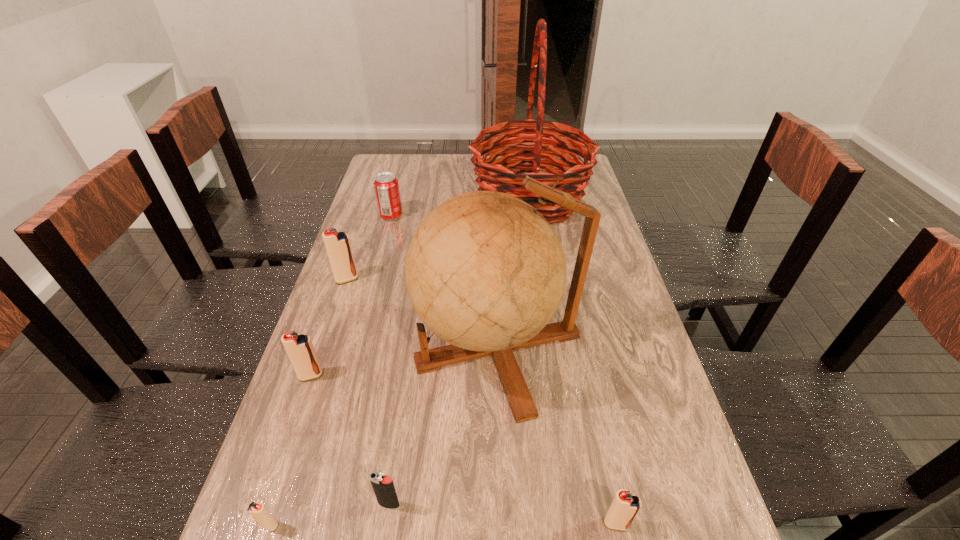
Where is `vacant space situated 0.090m on the right of the third nearest igniter`? Image resolution: width=960 pixels, height=540 pixels. vacant space situated 0.090m on the right of the third nearest igniter is located at coordinates (447, 504).

Identify the location of free location located 0.250m on the back of the third biggest red igniter. (589, 398).

This screenshot has width=960, height=540. Find the location of `free spot located 0.280m on the back of the shortest object`. free spot located 0.280m on the back of the shortest object is located at coordinates [314, 388].

The height and width of the screenshot is (540, 960). I want to click on object that is positioned at the far edge, so click(x=494, y=174).

Where is `soda that is at the left edge`? The height and width of the screenshot is (540, 960). soda that is at the left edge is located at coordinates (386, 186).

At what (x,y) coordinates should I click in order to perform the action: click on basket that is at the right edge. Please return your answer as a coordinate pair (x, y). Looking at the image, I should click on (494, 174).

Where is `igniter that is at the right edge`? Image resolution: width=960 pixels, height=540 pixels. igniter that is at the right edge is located at coordinates (625, 506).

Find the location of a particular element. The width and height of the screenshot is (960, 540). object that is positioned at the far right corner is located at coordinates (494, 174).

The image size is (960, 540). In the image, there is a desktop. In order to click on free space at the far edge in this screenshot , I will do `click(444, 156)`.

This screenshot has height=540, width=960. In the image, there is a desktop. Find the location of `blank space at the left edge`. blank space at the left edge is located at coordinates tap(317, 403).